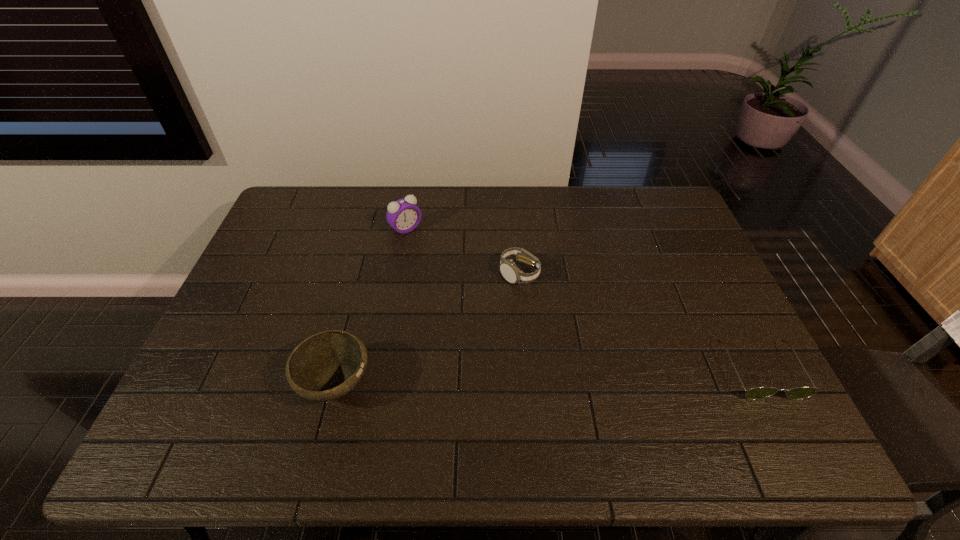
At what (x,y) coordinates should I click in order to perform the action: click on vacant space that is in between the second object from right to left and the farthest object. Please return your answer as a coordinate pair (x, y). Looking at the image, I should click on (463, 251).

This screenshot has width=960, height=540. I want to click on free space between the bowl and the watch, so click(x=427, y=329).

The width and height of the screenshot is (960, 540). I want to click on vacant space that is in between the farthest object and the third tallest object, so click(x=463, y=251).

Identify which object is located as the second nearest to the second object from right to left. Please provide its 2D coordinates. Your answer should be formatted as a tuple, i.e. [(x, y)], where the tuple contains the x and y coordinates of a point satisfying the conditions above.

[(325, 366)]

The height and width of the screenshot is (540, 960). In order to click on object that can be found as the third closest to the watch in this screenshot , I will do `click(756, 393)`.